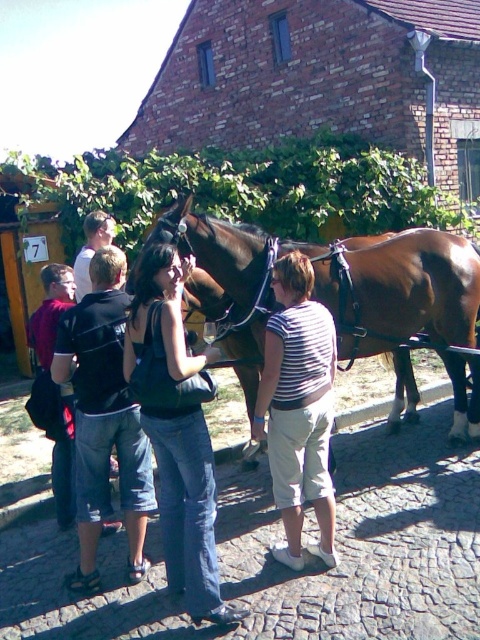
You are a photographer positioned at the front of the scene. You want to take a photo that includes both the denim jeans at center and the black cotton shirt at center. Which object should you focus on first to ensure both are in sharp focus?

You should focus on the denim jeans at center first since it is closer to the viewer than the black cotton shirt at center. By focusing on the closer object, the depth of field may also keep the farther object in focus.

You are a photographer trying to capture a photo of both the brown glossy horse at center and the striped fabric shirt at center. Based on their positions, which object should you focus on first to ensure both are in frame?

The brown glossy horse at center is above the striped fabric shirt at center, so you should focus on the striped fabric shirt at center first to ensure both are in frame.

Based on the photo, you are a photographer wanting to capture a photo of both the brown glossy horse at center and the striped fabric shirt at center in the same frame. Considering their sizes, which one should you focus on first to ensure both are in focus?

The brown glossy horse at center is much taller than the striped fabric shirt at center, so you should focus on the brown glossy horse at center first since it is larger and requires more attention to be in focus.